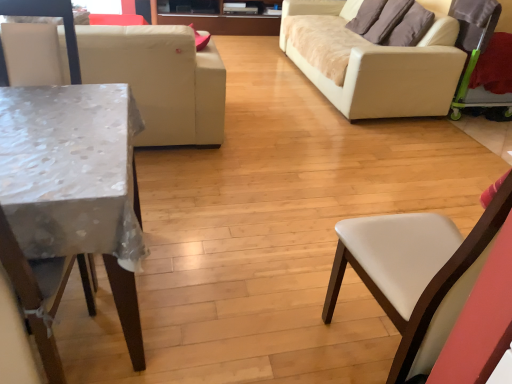
Question: Relative to white leather couch at left, placed as the 2th studio couch when sorted from right to left, is beige fabric studio couch at right, placed as the 1th studio couch when sorted from right to left, in front or behind?

Choices:
 (A) front
 (B) behind

Answer: (B)

Question: Visually, is beige fabric studio couch at right, the 2th studio couch in the left-to-right sequence, positioned to the left or to the right of white leather couch at left, the first studio couch from the left?

Choices:
 (A) right
 (B) left

Answer: (A)

Question: Which object is positioned closest to the white leather chair at left, marked as the 2th chair in a right-to-left arrangement?

Choices:
 (A) brown fabric pillow at upper right, which is counted as the 2th pillow, starting from the back
 (B) beige fabric studio couch at right, placed as the 1th studio couch when sorted from right to left
 (C) brown fabric pillow at upper right, which is the first pillow in back-to-front order
 (D) white leather chair at right, which is the 1th chair in right-to-left order
 (E) white leather couch at left, the first studio couch from the left

Answer: (E)

Question: Which object is the farthest from the white leather chair at right, the second chair from the left?

Choices:
 (A) white leather couch at left, placed as the 2th studio couch when sorted from right to left
 (B) beige fabric studio couch at right, placed as the 1th studio couch when sorted from right to left
 (C) green plastic swivel chair at right
 (D) brown fabric pillow at upper right, which is counted as the 2th pillow, starting from the back
 (E) metallic silver table at left

Answer: (D)